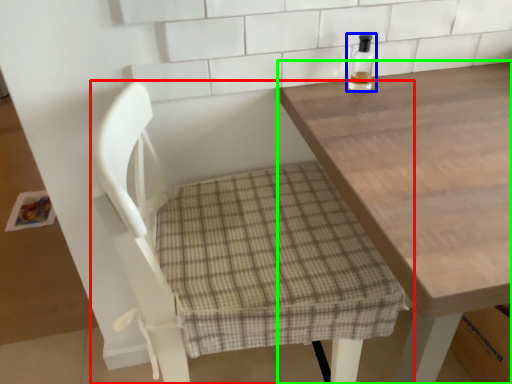
Question: Estimate the real-world distances between objects in this image. Which object is closer to chair (highlighted by a red box), bottle (highlighted by a blue box) or table (highlighted by a green box)?

Choices:
 (A) bottle
 (B) table

Answer: (B)